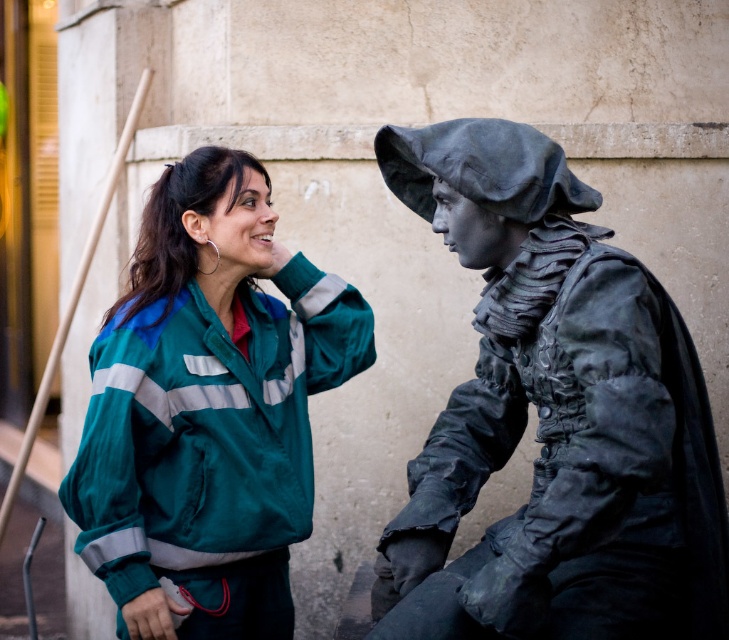
Is black matte statue at right above green fabric jacket at center?

No.

Does black matte statue at right appear on the left side of green fabric jacket at center?

No, black matte statue at right is not to the left of green fabric jacket at center.

Which is behind, point (537, 561) or point (160, 296)?

Positioned behind is point (160, 296).

Image resolution: width=729 pixels, height=640 pixels. I want to click on black matte statue at right, so click(553, 417).